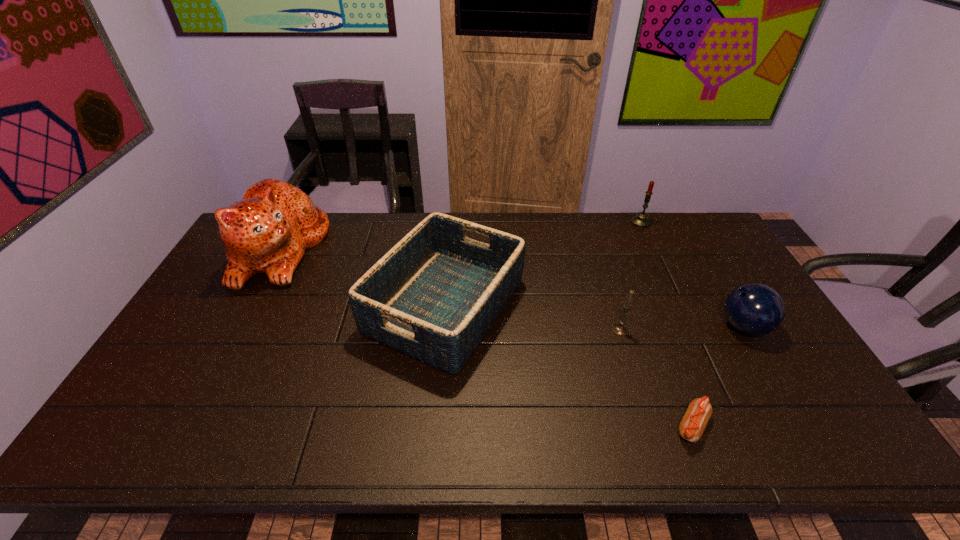
Identify the location of basket present at the far edge. This screenshot has width=960, height=540. (434, 296).

At what (x,y) coordinates should I click in order to perform the action: click on object present at the near edge. Please return your answer as a coordinate pair (x, y). Looking at the image, I should click on click(x=691, y=428).

The image size is (960, 540). What are the coordinates of `object at the left edge` in the screenshot? It's located at (267, 232).

Where is `object that is at the right edge`? object that is at the right edge is located at coordinates (755, 309).

Where is `object that is at the far left corner`? object that is at the far left corner is located at coordinates (267, 232).

Image resolution: width=960 pixels, height=540 pixels. In order to click on vacant space at the far edge of the desktop in this screenshot , I will do `click(603, 248)`.

At what (x,y) coordinates should I click in order to perform the action: click on vacant area at the near edge. Please return your answer as a coordinate pair (x, y). The width and height of the screenshot is (960, 540). Looking at the image, I should click on (624, 443).

I want to click on free space at the left edge of the desktop, so click(x=219, y=278).

You are a GUI agent. You are given a task and a screenshot of the screen. Output one action in this format:
    pyautogui.click(x=<x>, y=<y>)
    Task: Click on the free spot at the right edge of the desktop
    Image resolution: width=960 pixels, height=540 pixels.
    Given the screenshot: What is the action you would take?
    pyautogui.click(x=764, y=406)

The width and height of the screenshot is (960, 540). In the image, there is a desktop. In order to click on vacant space at the far right corner in this screenshot , I will do pos(714,230).